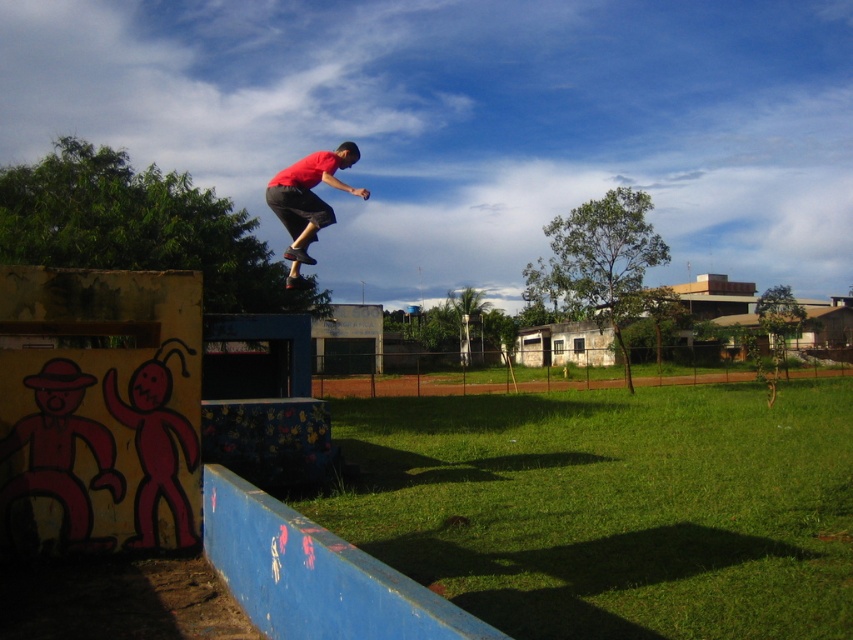
Question: Which of the following is the closest to the observer?

Choices:
 (A) matte red shirt at center
 (B) wooden brown skateboard at center

Answer: (A)

Question: Can you confirm if matte red shirt at center is positioned below wooden brown skateboard at center?

Choices:
 (A) no
 (B) yes

Answer: (A)

Question: Is matte red shirt at center positioned at the back of wooden brown skateboard at center?

Choices:
 (A) yes
 (B) no

Answer: (B)

Question: Which point is farther to the camera?

Choices:
 (A) (305, 196)
 (B) (293, 250)

Answer: (A)

Question: Is matte red shirt at center smaller than wooden brown skateboard at center?

Choices:
 (A) no
 (B) yes

Answer: (A)

Question: Which point is farther to the camera?

Choices:
 (A) (325, 220)
 (B) (285, 248)

Answer: (B)